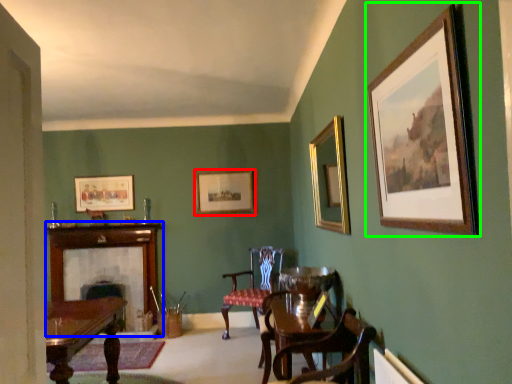
Question: Which object is the farthest from picture frame (highlighted by a red box)? Choose among these: fireplace (highlighted by a blue box) or picture frame (highlighted by a green box).

Choices:
 (A) fireplace
 (B) picture frame

Answer: (B)